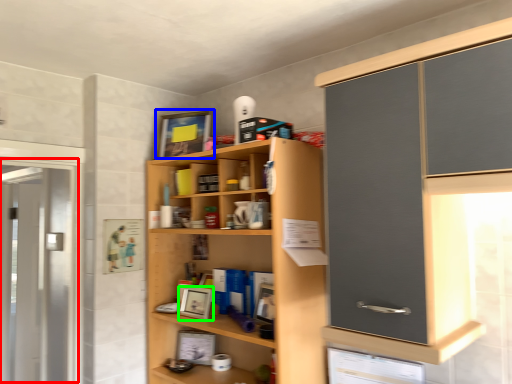
Question: Which object is the farthest from screen door (highlighted by a red box)? Choose among these: picture frame (highlighted by a blue box) or picture frame (highlighted by a green box).

Choices:
 (A) picture frame
 (B) picture frame

Answer: (B)